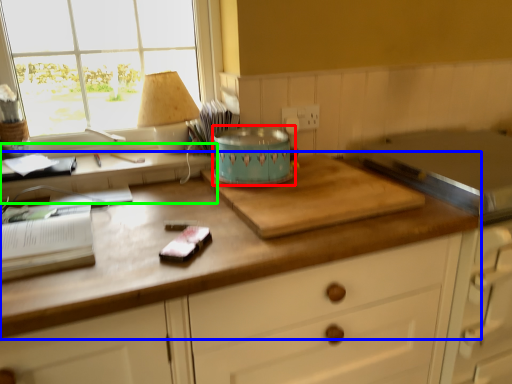
Question: Which is nearer to the appliance (highlighted by a red box)? countertop (highlighted by a blue box) or computer desk (highlighted by a green box).

Choices:
 (A) countertop
 (B) computer desk

Answer: (B)